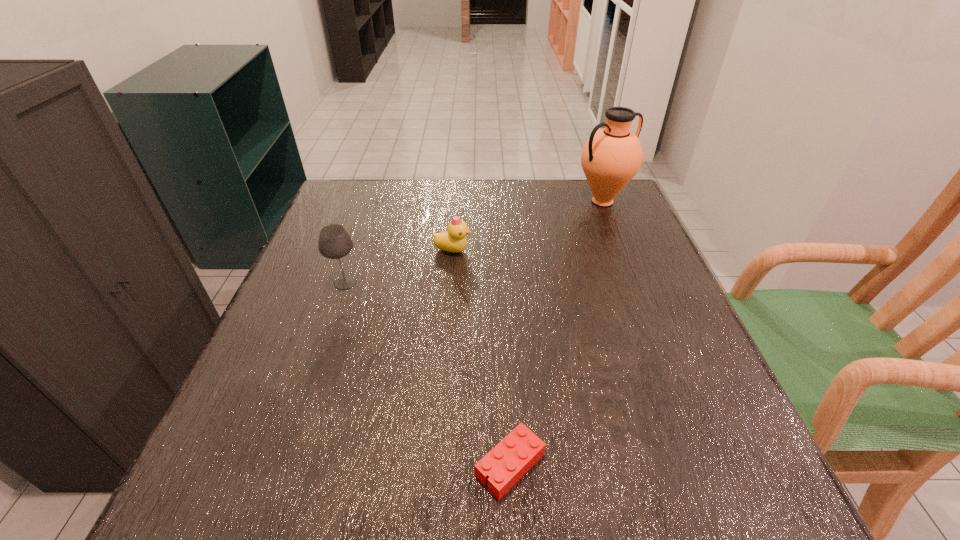
The height and width of the screenshot is (540, 960). Find the location of `free space at the far left corner of the desktop`. free space at the far left corner of the desktop is located at coordinates (x=377, y=191).

Locate an element on the screen. Image resolution: width=960 pixels, height=540 pixels. vacant space at the near right corner of the desktop is located at coordinates (660, 463).

At what (x,y) coordinates should I click in order to perform the action: click on unoccupied position between the third shortest object and the third object from left to right. Please return your answer as a coordinate pair (x, y). This screenshot has width=960, height=540. Looking at the image, I should click on (427, 374).

The height and width of the screenshot is (540, 960). I want to click on vacant area between the second farthest object and the Lego, so click(481, 358).

Where is `free space between the third nearest object and the second object from right to left`? Image resolution: width=960 pixels, height=540 pixels. free space between the third nearest object and the second object from right to left is located at coordinates (481, 358).

The height and width of the screenshot is (540, 960). Find the location of `free space between the duckling and the leftmost object`. free space between the duckling and the leftmost object is located at coordinates (399, 266).

The image size is (960, 540). In order to click on free space that is in between the rightmost object and the leftmost object in this screenshot , I will do `click(474, 242)`.

Identify the location of free space between the third shortest object and the third object from left to right. (427, 374).

The width and height of the screenshot is (960, 540). What are the coordinates of `free space between the second shortest object and the shortest object` in the screenshot? It's located at (481, 358).

The image size is (960, 540). What are the coordinates of `free space between the third farthest object and the duckling` in the screenshot? It's located at (399, 266).